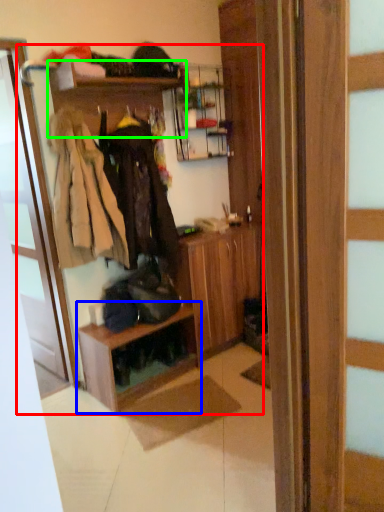
Question: Which is farther away from dresser (highlighted by a red box)? shelf (highlighted by a blue box) or shelf (highlighted by a green box)?

Choices:
 (A) shelf
 (B) shelf

Answer: (B)